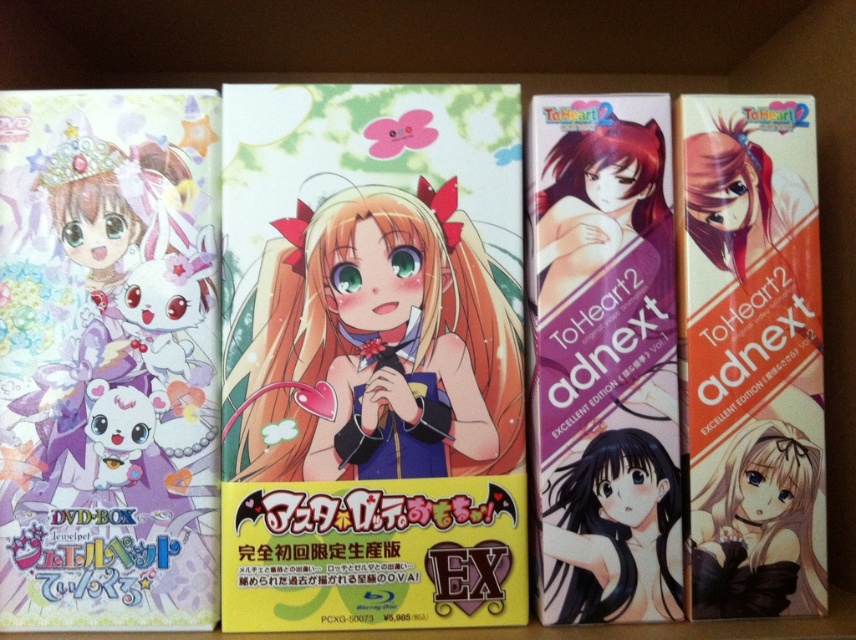
Consider the image. Can you confirm if purple glossy book at center is shorter than black glossy hair at center?

No.

Which is more to the right, purple glossy book at center or black glossy hair at center?

Positioned to the right is black glossy hair at center.

Is point (667, 282) less distant than point (589, 556)?

That is False.

You are a GUI agent. You are given a task and a screenshot of the screen. Output one action in this format:
    pyautogui.click(x=<x>, y=<y>)
    Task: Click on the purple glossy book at center
    Image resolution: width=856 pixels, height=640 pixels.
    Given the screenshot: What is the action you would take?
    pyautogui.click(x=603, y=360)

Between pastel matte card at center and orange matte book at right, which one is positioned lower?

Positioned lower is pastel matte card at center.

Which of these two, pastel matte card at center or orange matte book at right, stands shorter?

Standing shorter between the two is pastel matte card at center.

Is point (513, 292) farther from camera compared to point (800, 253)?

No.

The width and height of the screenshot is (856, 640). I want to click on pastel matte card at center, so click(x=376, y=346).

Is orange matte book at right wider than smooth brown hair at center?

Yes.

Between orange matte book at right and smooth brown hair at center, which one appears on the left side from the viewer's perspective?

From the viewer's perspective, orange matte book at right appears more on the left side.

Is point (733, 225) in front of point (717, 577)?

No, it is behind (717, 577).

Locate an element on the screen. Image resolution: width=856 pixels, height=640 pixels. orange matte book at right is located at coordinates (750, 355).